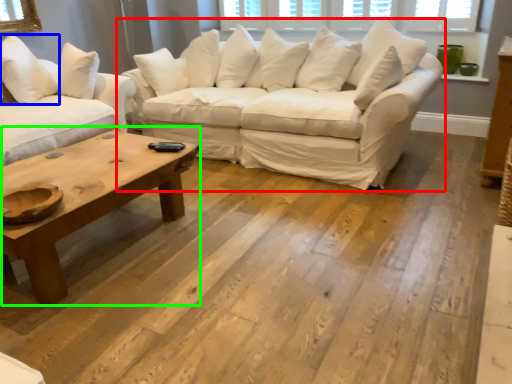
Question: Estimate the real-world distances between objects in this image. Which object is farther from studio couch (highlighted by a red box), pillow (highlighted by a blue box) or coffee table (highlighted by a green box)?

Choices:
 (A) pillow
 (B) coffee table

Answer: (A)